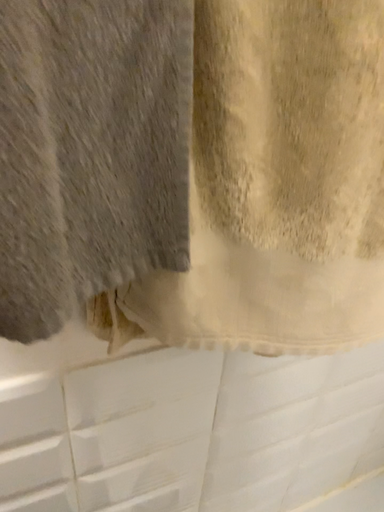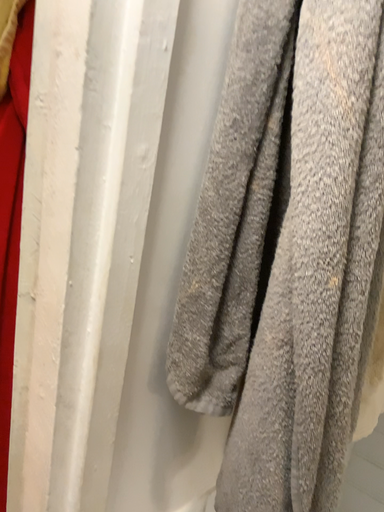
Question: How did the camera likely rotate when shooting the video?

Choices:
 (A) rotated right
 (B) rotated left

Answer: (A)